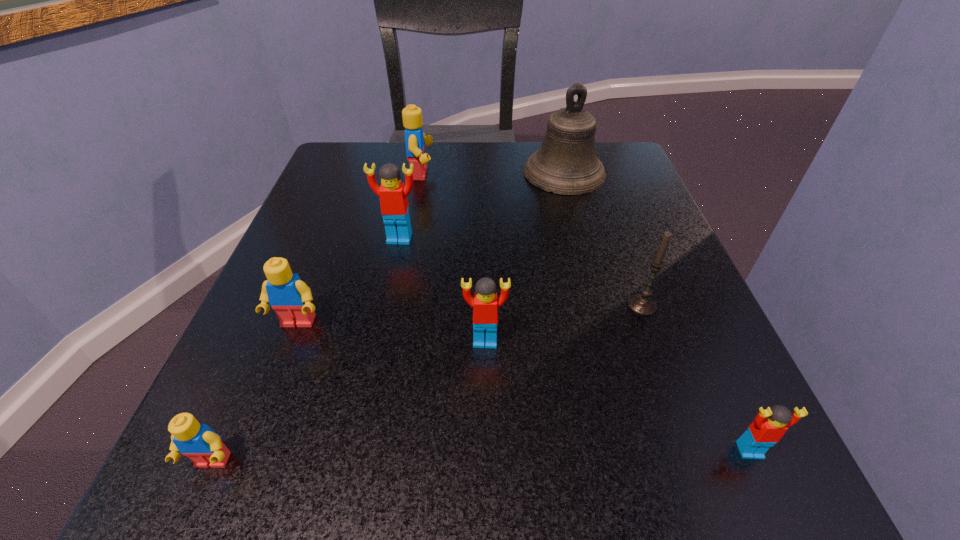
Where is `vacant area between the gray candle and the bell`? The height and width of the screenshot is (540, 960). vacant area between the gray candle and the bell is located at coordinates (603, 239).

You are a GUI agent. You are given a task and a screenshot of the screen. Output one action in this format:
    pyautogui.click(x=<x>, y=<y>)
    Task: Click on the empty space between the second biggest yellow Lego and the second Lego from right to left
    This screenshot has height=540, width=960.
    Given the screenshot: What is the action you would take?
    pyautogui.click(x=392, y=332)

Where is `object that is the sixth nearest to the second farthest yellow Lego`? object that is the sixth nearest to the second farthest yellow Lego is located at coordinates (643, 304).

Locate an element on the screen. The width and height of the screenshot is (960, 540). object that is the fourth closest to the rightmost object is located at coordinates (393, 194).

Select which Lego is the fifth closest to the farthest Lego. Please provide its 2D coordinates. Your answer should be formatted as a tuple, i.e. [(x, y)], where the tuple contains the x and y coordinates of a point satisfying the conditions above.

[(769, 425)]

Find the location of a particular element. The height and width of the screenshot is (540, 960). Lego that is the closest to the nearest yellow Lego is located at coordinates click(x=287, y=294).

Where is `the closest red Lego to the second smallest yellow Lego`? The height and width of the screenshot is (540, 960). the closest red Lego to the second smallest yellow Lego is located at coordinates (393, 194).

Where is `red Lego that is the second closest to the second biggest yellow Lego`? This screenshot has width=960, height=540. red Lego that is the second closest to the second biggest yellow Lego is located at coordinates (485, 304).

Locate which yellow Lego ranks second in proximity to the second Lego from right to left. Please provide its 2D coordinates. Your answer should be formatted as a tuple, i.e. [(x, y)], where the tuple contains the x and y coordinates of a point satisfying the conditions above.

[(203, 446)]

Identify the location of yellow Lego that stands as the closest to the nearest yellow Lego. (287, 294).